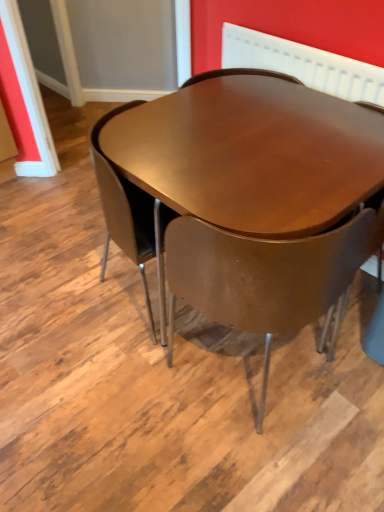
The image size is (384, 512). In order to click on free spot above white textured radiator at upper center (from a real-world perspective) in this screenshot , I will do `click(337, 45)`.